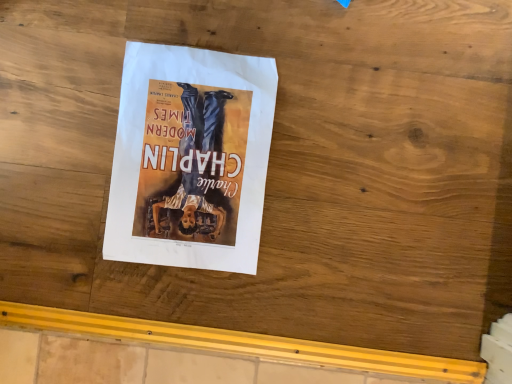
Where is `vacant space situated above matte paper poster at center (from a real-world perspective)`? This screenshot has height=384, width=512. vacant space situated above matte paper poster at center (from a real-world perspective) is located at coordinates (187, 155).